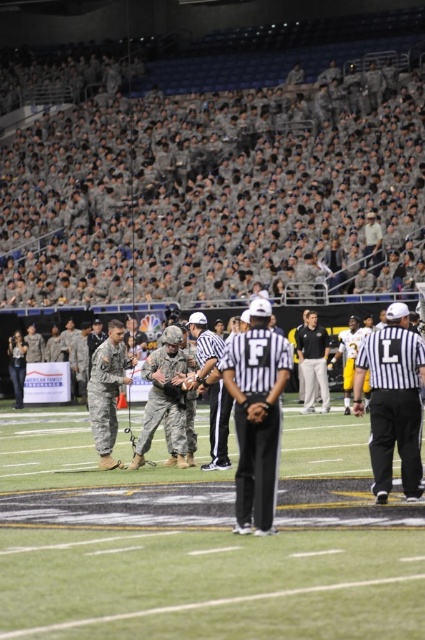
Is camouflage fabric uniform at center closer to camera compared to black smooth shirt at center?

Yes, it is in front of black smooth shirt at center.

Find the location of a particular element. This screenshot has width=425, height=640. camouflage fabric uniform at center is located at coordinates point(107,392).

Is point (320, 497) farther from camera compared to point (102, 422)?

No, (320, 497) is closer to viewer.

Is point (34, 440) positioned before point (99, 404)?

That is False.

Locate an element on the screen. The height and width of the screenshot is (640, 425). green turf at center is located at coordinates (201, 541).

Is black striped shirt at center taller than camouflage fabric uniform at center?

Indeed, black striped shirt at center has a greater height compared to camouflage fabric uniform at center.

Is black striped shirt at center to the left of camouflage fabric uniform at center from the viewer's perspective?

Incorrect, black striped shirt at center is not on the left side of camouflage fabric uniform at center.

The height and width of the screenshot is (640, 425). What are the coordinates of `black striped shirt at center` in the screenshot? It's located at (393, 401).